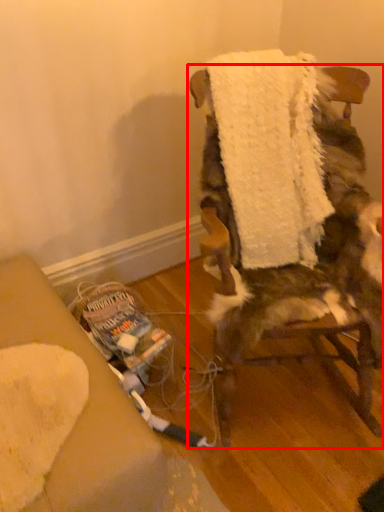
Question: From the image's perspective, where is chair (annotated by the red box) located in relation to bath towel in the image?

Choices:
 (A) below
 (B) above

Answer: (A)